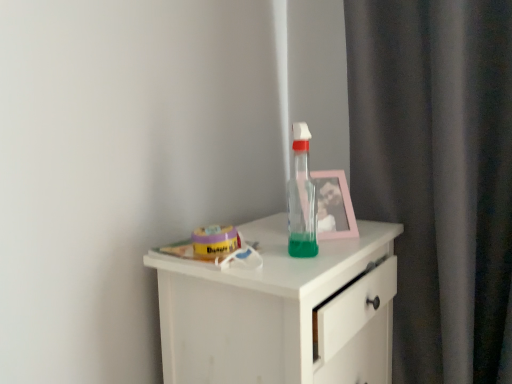
Question: Can you confirm if pink plastic picture frame at upper right is positioned to the left of transparent plastic bottle at center?

Choices:
 (A) no
 (B) yes

Answer: (A)

Question: Does pink plastic picture frame at upper right have a greater height compared to transparent plastic bottle at center?

Choices:
 (A) yes
 (B) no

Answer: (B)

Question: From a real-world perspective, is pink plastic picture frame at upper right under transparent plastic bottle at center?

Choices:
 (A) yes
 (B) no

Answer: (A)

Question: Is transparent plastic bottle at center inside pink plastic picture frame at upper right?

Choices:
 (A) no
 (B) yes

Answer: (A)

Question: Is pink plastic picture frame at upper right closer to camera compared to transparent plastic bottle at center?

Choices:
 (A) no
 (B) yes

Answer: (A)

Question: From a real-world perspective, is white matte chest of drawers at center physically located above or below transparent plastic bottle at center?

Choices:
 (A) above
 (B) below

Answer: (B)

Question: In terms of height, does white matte chest of drawers at center look taller or shorter compared to transparent plastic bottle at center?

Choices:
 (A) short
 (B) tall

Answer: (B)

Question: From the image's perspective, is white matte chest of drawers at center positioned above or below transparent plastic bottle at center?

Choices:
 (A) above
 (B) below

Answer: (B)

Question: Do you think white matte chest of drawers at center is within transparent plastic bottle at center, or outside of it?

Choices:
 (A) outside
 (B) inside

Answer: (A)

Question: From their relative heights in the image, would you say transparent plastic bottle at center is taller or shorter than white matte chest of drawers at center?

Choices:
 (A) short
 (B) tall

Answer: (A)

Question: Is transparent plastic bottle at center spatially inside white matte chest of drawers at center, or outside of it?

Choices:
 (A) inside
 (B) outside

Answer: (B)

Question: From a real-world perspective, is transparent plastic bottle at center positioned above or below white matte chest of drawers at center?

Choices:
 (A) below
 (B) above

Answer: (B)

Question: Is transparent plastic bottle at center bigger or smaller than white matte chest of drawers at center?

Choices:
 (A) big
 (B) small

Answer: (B)

Question: Based on their sizes in the image, would you say pink plastic picture frame at upper right is bigger or smaller than transparent plastic bottle at center?

Choices:
 (A) small
 (B) big

Answer: (B)

Question: From the image's perspective, is pink plastic picture frame at upper right positioned above or below transparent plastic bottle at center?

Choices:
 (A) below
 (B) above

Answer: (A)